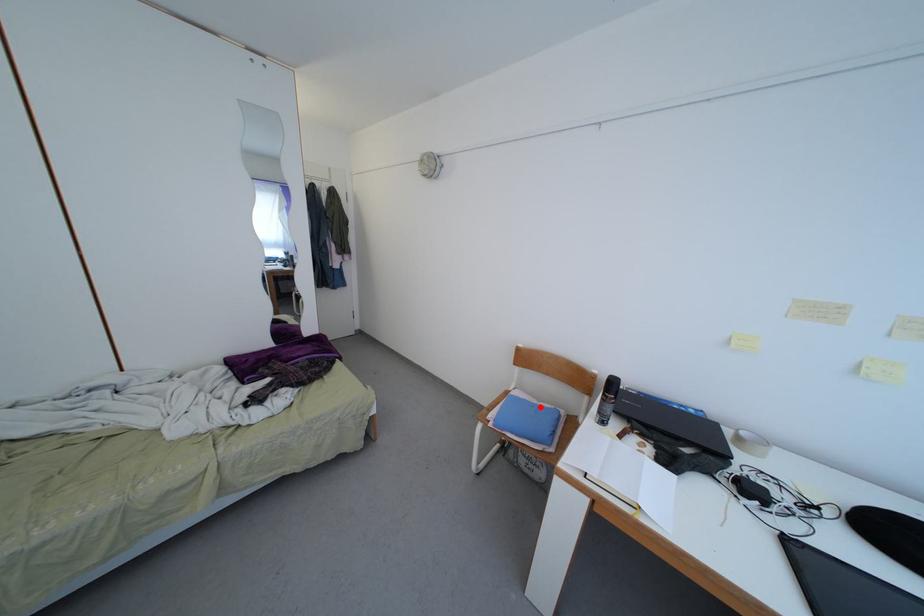
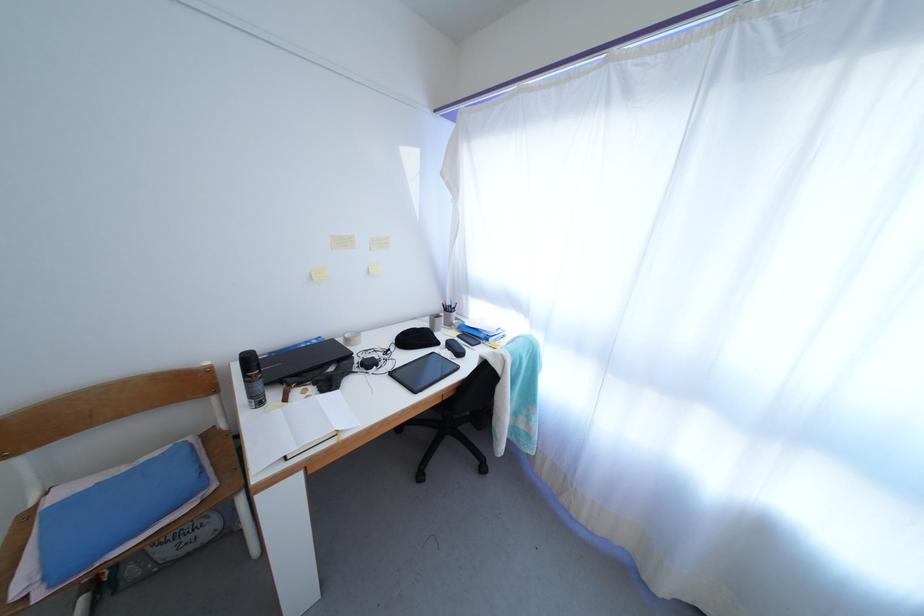
Locate, in the second image, the point that corresponds to the highlighted location in the first image.

(129, 475)